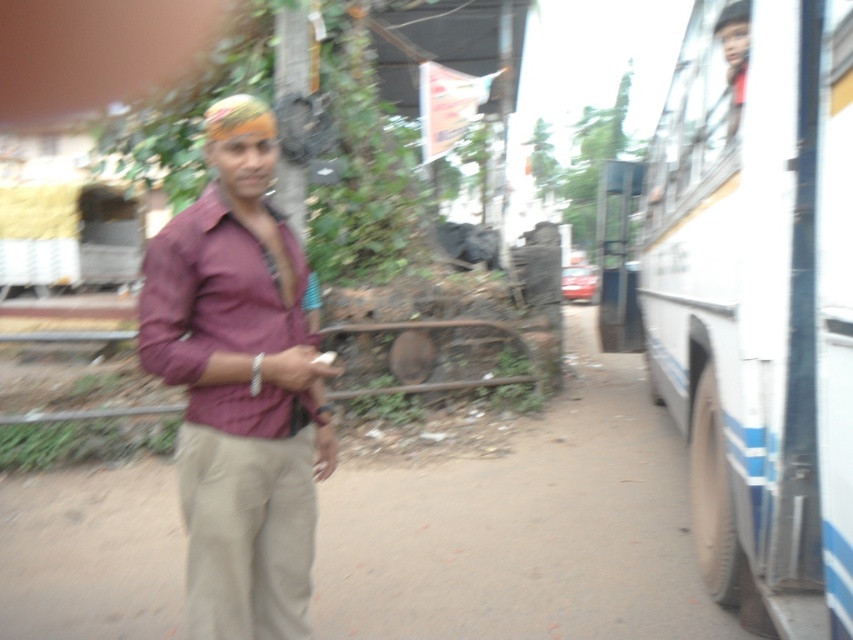
You are a photographer trying to capture a clear shot of both the white matte bus at right and the khaki pants at center. Given that the bus is wider than the khaki pants, how should you adjust your camera framing to ensure both are fully visible in the photo?

Since the white matte bus at right is wider than the khaki pants at center, you should position your camera to focus on the center area where the khaki pants are located while widening the frame to include the entire width of the white matte bus at right.

You are a pedestrian trying to cross the street and see the white matte bus at right and the khaki pants at center. Which object is positioned more to the right side of the image?

The white matte bus at right is positioned to the right of the khaki pants at center, so the white matte bus at right is more to the right side of the image.